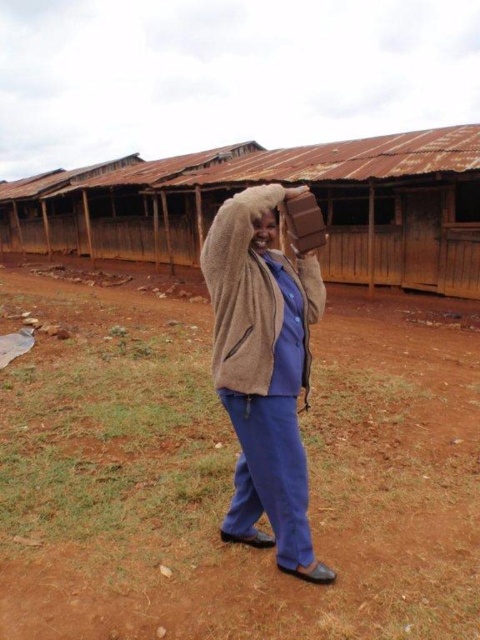
Who is shorter, fuzzy brown sweater at center or brown fuzzy hat at center?

brown fuzzy hat at center

Is fuzzy brown sweater at center to the left of brown fuzzy hat at center from the viewer's perspective?

No, fuzzy brown sweater at center is not to the left of brown fuzzy hat at center.

Image resolution: width=480 pixels, height=640 pixels. Identify the location of fuzzy brown sweater at center. (264, 376).

Is brown dirt field at center shorter than fuzzy brown sweater at center?

Yes.

Between point (342, 301) and point (219, 250), which one is positioned in front?

Positioned in front is point (219, 250).

Does point (33, 524) come farther from viewer compared to point (264, 346)?

Yes.

Image resolution: width=480 pixels, height=640 pixels. Find the location of `brown dirt field at center`. brown dirt field at center is located at coordinates (229, 476).

Can you confirm if brown dirt field at center is positioned to the left of brown fuzzy hat at center?

Indeed, brown dirt field at center is positioned on the left side of brown fuzzy hat at center.

Who is positioned more to the right, brown dirt field at center or brown fuzzy hat at center?

Positioned to the right is brown fuzzy hat at center.

Which is behind, point (41, 404) or point (274, 209)?

Positioned behind is point (41, 404).

Find the location of a particular element. brown dirt field at center is located at coordinates (229, 476).